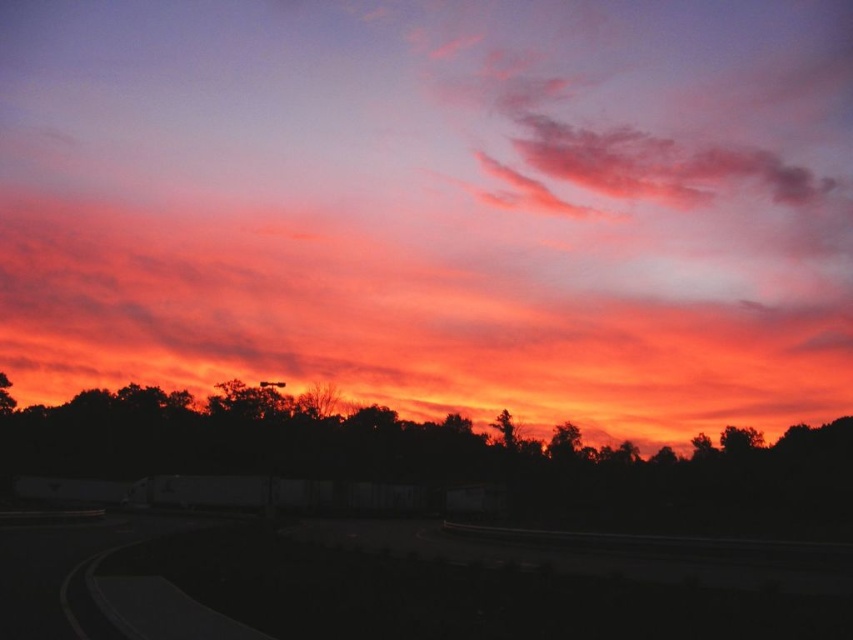
Is point (828, 426) positioned in front of point (500, 436)?

Yes.

Can you confirm if silhouette tree at center is shorter than green leafy tree at center?

No.

Which is in front, point (184, 451) or point (503, 428)?

Point (184, 451) is more forward.

Locate an element on the screen. The height and width of the screenshot is (640, 853). silhouette tree at center is located at coordinates 433,456.

Does matte orange cloud at upper center have a smaller size compared to silhouette tree at center?

No.

Image resolution: width=853 pixels, height=640 pixels. Describe the element at coordinates (436, 204) in the screenshot. I see `matte orange cloud at upper center` at that location.

Is point (830, 100) positioned behind point (15, 464)?

Yes.

Locate an element on the screen. This screenshot has width=853, height=640. matte orange cloud at upper center is located at coordinates (436, 204).

Measure the distance from black asphalt highway at lower center to silhouette tree at center.

They are 37.64 meters apart.

Is black asphalt highway at lower center bigger than silhouette tree at center?

No, black asphalt highway at lower center is not bigger than silhouette tree at center.

Identify the location of black asphalt highway at lower center. This screenshot has width=853, height=640. (387, 586).